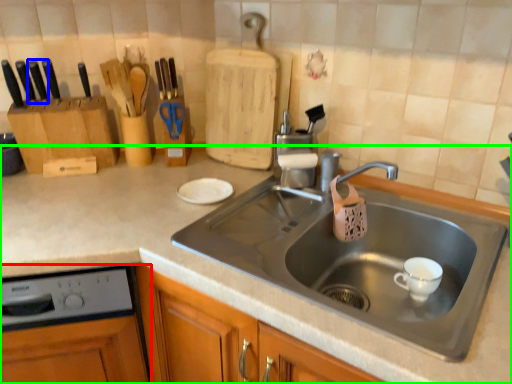
Question: Based on their relative distances, which object is farther from dish washer (highlighted by a red box)? Choose from knife (highlighted by a blue box) and countertop (highlighted by a green box).

Choices:
 (A) knife
 (B) countertop

Answer: (A)